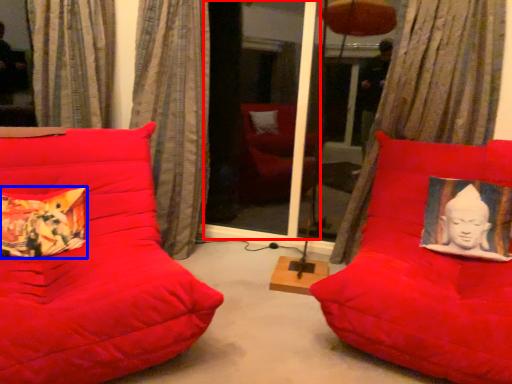
Question: Which object is further to the camera taking this photo, screen door (highlighted by a red box) or pillow (highlighted by a blue box)?

Choices:
 (A) screen door
 (B) pillow

Answer: (A)